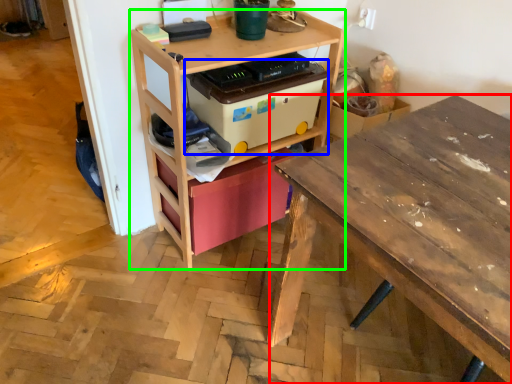
Question: Which object is the farthest from desk (highlighted by a red box)? Choose among these: storage box (highlighted by a blue box) or shelf (highlighted by a green box).

Choices:
 (A) storage box
 (B) shelf

Answer: (B)